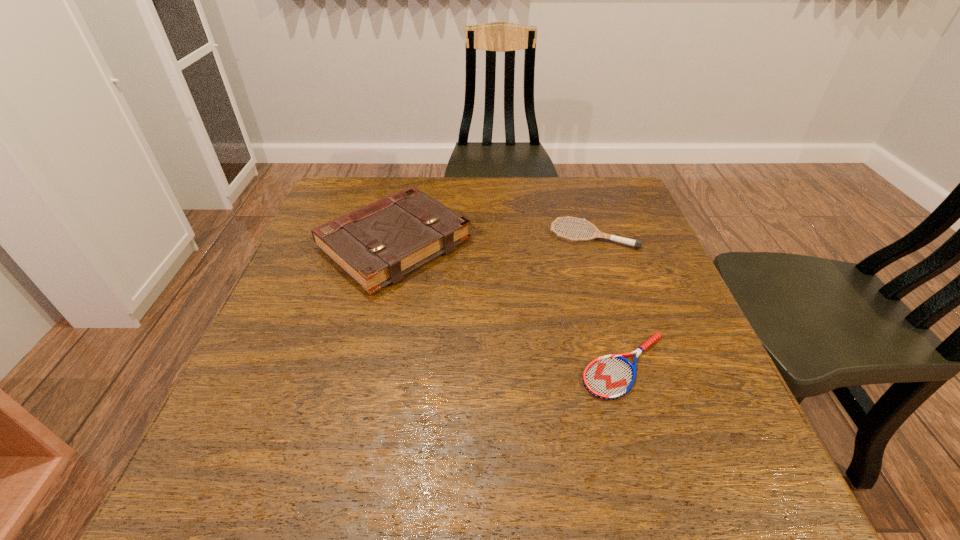
Find the location of a particular element. This screenshot has width=960, height=540. unoccupied position between the second shortest object and the leftmost object is located at coordinates (493, 240).

This screenshot has height=540, width=960. I want to click on object that is the second closest to the leftmost object, so click(609, 377).

The height and width of the screenshot is (540, 960). Find the location of `object that stands as the closest to the farther tennis racket`. object that stands as the closest to the farther tennis racket is located at coordinates (376, 245).

What are the coordinates of `vacant region that satisfies the following two spatial constraints: 1. on the front side of the hardback book; 2. on the left side of the nearest object` in the screenshot? It's located at (366, 366).

The image size is (960, 540). I want to click on vacant position in the image that satisfies the following two spatial constraints: 1. on the back side of the farther tennis racket; 2. on the right side of the nearest object, so click(587, 235).

Where is `vacant space that satisfies the following two spatial constraints: 1. on the back side of the second shortest object; 2. on the left side of the nearest object`? The height and width of the screenshot is (540, 960). vacant space that satisfies the following two spatial constraints: 1. on the back side of the second shortest object; 2. on the left side of the nearest object is located at coordinates (587, 235).

Find the location of a particular element. Image resolution: width=960 pixels, height=540 pixels. vacant space that satisfies the following two spatial constraints: 1. on the back side of the second tallest object; 2. on the left side of the leftmost object is located at coordinates (396, 235).

You are a GUI agent. You are given a task and a screenshot of the screen. Output one action in this format:
    pyautogui.click(x=<x>, y=<y>)
    Task: Click on the vacant space that satisfies the following two spatial constraints: 1. on the back side of the farther tennis racket; 2. on the right side of the nearer tennis racket
    The height and width of the screenshot is (540, 960).
    Given the screenshot: What is the action you would take?
    pyautogui.click(x=587, y=235)

Identify the location of vacant area that satisfies the following two spatial constraints: 1. on the front side of the shortest object; 2. on the left side of the tallest object. (366, 366).

Locate an element on the screen. The height and width of the screenshot is (540, 960). free region that satisfies the following two spatial constraints: 1. on the back side of the tallest object; 2. on the right side of the farther tennis racket is located at coordinates [x=396, y=235].